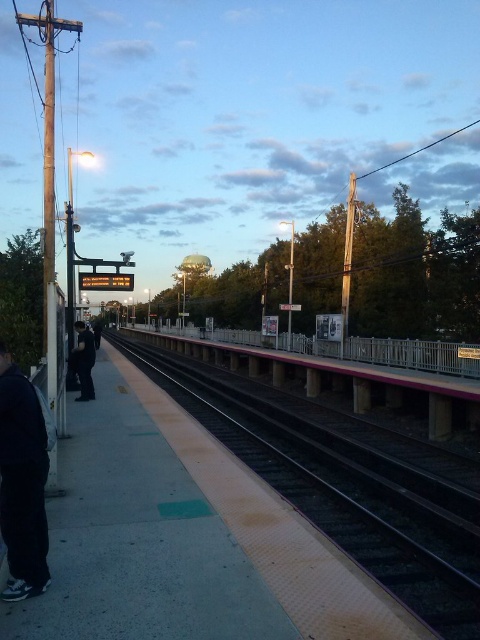
Which is above, smooth concrete track at center or dark blue jeans at left?

dark blue jeans at left is above.

Can you confirm if smooth concrete track at center is bigger than dark blue jeans at left?

Indeed, smooth concrete track at center has a larger size compared to dark blue jeans at left.

Locate an element on the screen. smooth concrete track at center is located at coordinates (346, 492).

Is black matte pants at lower left thinner than dark blue jeans at left?

Correct, black matte pants at lower left's width is less than dark blue jeans at left's.

Can you confirm if black matte pants at lower left is positioned above dark blue jeans at left?

No, black matte pants at lower left is not above dark blue jeans at left.

Measure the distance between point (14,588) and camera.

The distance of point (14,588) from camera is 3.99 meters.

Image resolution: width=480 pixels, height=640 pixels. In order to click on black matte pants at lower left in this screenshot , I will do `click(23, 483)`.

Between point (298, 468) and point (9, 412), which one is positioned behind?

Point (298, 468)

Who is lower down, smooth concrete track at center or black matte pants at lower left?

Positioned lower is smooth concrete track at center.

Is point (464, 496) in front of point (36, 429)?

No, (464, 496) is further to viewer.

Image resolution: width=480 pixels, height=640 pixels. In order to click on smooth concrete track at center in this screenshot , I will do `click(346, 492)`.